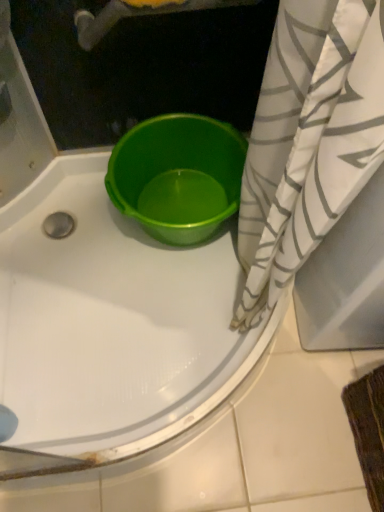
Image resolution: width=384 pixels, height=512 pixels. What do you see at coordinates (110, 327) in the screenshot? I see `matte green tub at center` at bounding box center [110, 327].

What do you see at coordinates (177, 170) in the screenshot? I see `green plastic bucket at center` at bounding box center [177, 170].

This screenshot has height=512, width=384. In order to click on white/gray striped fabric at right in this screenshot , I will do `click(309, 139)`.

Is matte green tub at center beside white/gray striped fabric at right?

matte green tub at center and white/gray striped fabric at right are clearly separated.

I want to click on curtain below the matte green tub at center (from a real-world perspective), so click(x=309, y=139).

Between point (140, 305) and point (324, 129), which one is positioned in front?

Point (324, 129)

Which of these two, white/gray striped fabric at right or green plastic bucket at center, is thinner?

With smaller width is green plastic bucket at center.

Can you confirm if white/gray striped fabric at right is positioned to the left of green plastic bucket at center?

In fact, white/gray striped fabric at right is to the right of green plastic bucket at center.

Between white/gray striped fabric at right and green plastic bucket at center, which one is positioned behind?

green plastic bucket at center is more distant.

Looking at this image, from the image's perspective, which object appears higher, white/gray striped fabric at right or green plastic bucket at center?

From the image's view, green plastic bucket at center is above.

Considering their positions, is green plastic bucket at center located in front of or behind white/gray striped fabric at right?

In the image, green plastic bucket at center appears behind white/gray striped fabric at right.

Does green plastic bucket at center have a smaller size compared to white/gray striped fabric at right?

Correct, green plastic bucket at center occupies less space than white/gray striped fabric at right.

Is point (123, 158) closer to viewer compared to point (323, 160)?

That is False.

Where is `curtain above the green plastic bucket at center (from a real-world perspective)`? The image size is (384, 512). curtain above the green plastic bucket at center (from a real-world perspective) is located at coordinates (309, 139).

Which point is more forward, (131, 210) or (47, 179)?

The point (131, 210) is closer.

Measure the distance from green plastic bucket at center to matte green tub at center.

green plastic bucket at center is 9.53 inches from matte green tub at center.

Which of these two, green plastic bucket at center or matte green tub at center, stands shorter?

Standing shorter between the two is green plastic bucket at center.

Would you say matte green tub at center is part of green plastic bucket at center's contents?

No, matte green tub at center is not inside green plastic bucket at center.

Is the depth of white/gray striped fabric at right less than that of matte green tub at center?

No.

Find the location of a particular element. Image resolution: width=384 pixels, height=512 pixels. curtain below the matte green tub at center (from a real-world perspective) is located at coordinates (309, 139).

Considering the sizes of objects white/gray striped fabric at right and matte green tub at center in the image provided, who is shorter, white/gray striped fabric at right or matte green tub at center?

Standing shorter between the two is white/gray striped fabric at right.

Considering the relative sizes of matte green tub at center and green plastic bucket at center in the image provided, is matte green tub at center taller than green plastic bucket at center?

Correct, matte green tub at center is much taller as green plastic bucket at center.

Based on the photo, is matte green tub at center to the left of green plastic bucket at center from the viewer's perspective?

Correct, you'll find matte green tub at center to the left of green plastic bucket at center.

Considering the points (228, 351) and (188, 154), which point is in front, point (228, 351) or point (188, 154)?

The point (228, 351) is in front.

Find the location of a particular element. curtain lying behind the matte green tub at center is located at coordinates pyautogui.click(x=309, y=139).

Image resolution: width=384 pixels, height=512 pixels. In the image, there is a white/gray striped fabric at right. What are the coordinates of `basin below it (from a real-world perspective)` in the screenshot? It's located at (177, 170).

From the picture: Estimate the real-world distances between objects in this image. Which object is further from white/gray striped fabric at right, green plastic bucket at center or matte green tub at center?

The object further to white/gray striped fabric at right is matte green tub at center.

When comparing their distances from matte green tub at center, does white/gray striped fabric at right or green plastic bucket at center seem further?

white/gray striped fabric at right is further to matte green tub at center.

Which object lies further to the anchor point green plastic bucket at center, matte green tub at center or white/gray striped fabric at right?

white/gray striped fabric at right lies further to green plastic bucket at center than the other object.

Considering their positions, is matte green tub at center positioned further to white/gray striped fabric at right than green plastic bucket at center?

Based on the image, matte green tub at center appears to be further to white/gray striped fabric at right.

When comparing their distances from matte green tub at center, does green plastic bucket at center or white/gray striped fabric at right seem further?

white/gray striped fabric at right is positioned further to the anchor matte green tub at center.

When comparing their distances from green plastic bucket at center, does white/gray striped fabric at right or matte green tub at center seem closer?

matte green tub at center is closer to green plastic bucket at center.

Locate an element on the screen. This screenshot has width=384, height=512. curtain between matte green tub at center and green plastic bucket at center along the z-axis is located at coordinates (309, 139).